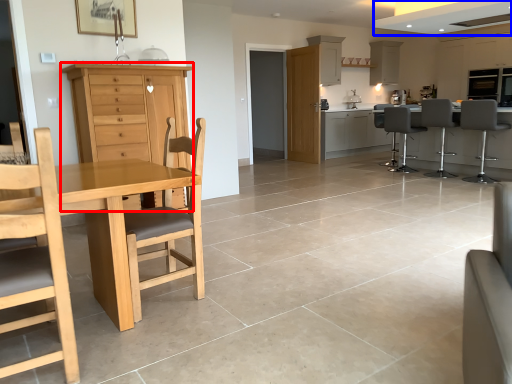
Question: Which object is further to the camera taking this photo, cabinetry (highlighted by a red box) or exhaust hood (highlighted by a blue box)?

Choices:
 (A) cabinetry
 (B) exhaust hood

Answer: (B)